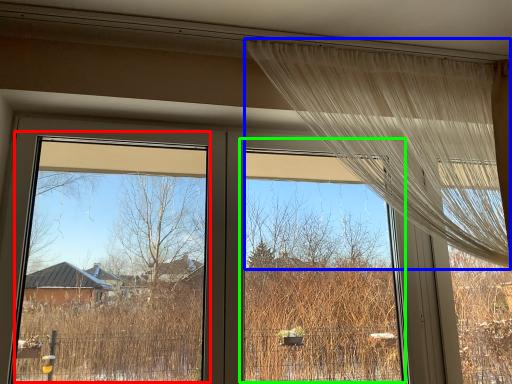
Question: Which object is the farthest from window screen (highlighted by a red box)? Choose among these: curtain (highlighted by a blue box) or window screen (highlighted by a green box).

Choices:
 (A) curtain
 (B) window screen

Answer: (A)